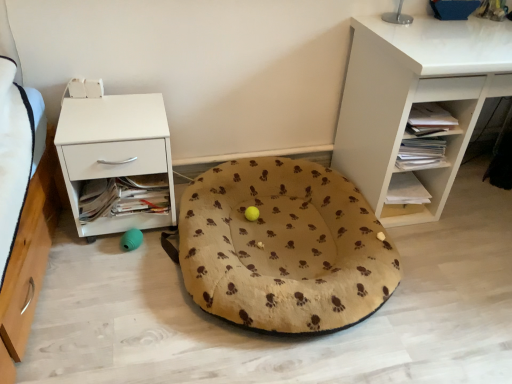
Describe the element at coordinates (283, 247) in the screenshot. I see `beige fabric dog bed at center` at that location.

What do you see at coordinates (114, 152) in the screenshot? The width and height of the screenshot is (512, 384). I see `white matte nightstand at left` at bounding box center [114, 152].

Where is `beige fabric dog bed at center`? The height and width of the screenshot is (384, 512). beige fabric dog bed at center is located at coordinates (283, 247).

Is white matte desk at upper right, arranged as the 1th shelf when viewed from the top, not inside white matte shelf at center right, the 2th shelf viewed from the top?

Yes, white matte desk at upper right, arranged as the 1th shelf when viewed from the top, is outside of white matte shelf at center right, the 2th shelf viewed from the top.

Who is smaller, white matte desk at upper right, the 2th shelf when ordered from bottom to top, or white matte shelf at center right, the 2th shelf viewed from the top?

With smaller size is white matte shelf at center right, the 2th shelf viewed from the top.

From a real-world perspective, is white matte desk at upper right, the 2th shelf when ordered from bottom to top, on top of white matte shelf at center right, marked as the 1th shelf in a bottom-to-top arrangement?

Yes, from a real-world perspective, white matte desk at upper right, the 2th shelf when ordered from bottom to top, is above white matte shelf at center right, marked as the 1th shelf in a bottom-to-top arrangement.

From a real-world perspective, does white matte shelf at center right, the 2th shelf viewed from the top, sit lower than beige fabric dog bed at center?

No, from a real-world perspective, white matte shelf at center right, the 2th shelf viewed from the top, is not beneath beige fabric dog bed at center.

Is white matte shelf at center right, marked as the 1th shelf in a bottom-to-top arrangement, in contact with beige fabric dog bed at center?

No, white matte shelf at center right, marked as the 1th shelf in a bottom-to-top arrangement, is not touching beige fabric dog bed at center.

Can you confirm if white matte shelf at center right, marked as the 1th shelf in a bottom-to-top arrangement, is taller than beige fabric dog bed at center?

In fact, white matte shelf at center right, marked as the 1th shelf in a bottom-to-top arrangement, may be shorter than beige fabric dog bed at center.

Find the location of a particular element. The height and width of the screenshot is (384, 512). table lamp that appears on the left of white matte shelf at center right, marked as the 1th shelf in a bottom-to-top arrangement is located at coordinates (397, 16).

Is metallic silver table lamp at upper center not inside white matte shelf at center right, the 2th shelf viewed from the top?

Absolutely, metallic silver table lamp at upper center is external to white matte shelf at center right, the 2th shelf viewed from the top.

Is metallic silver table lamp at upper center turned away from white matte shelf at center right, the 2th shelf viewed from the top?

No, metallic silver table lamp at upper center's orientation is not away from white matte shelf at center right, the 2th shelf viewed from the top.

From a real-world perspective, is metallic silver table lamp at upper center located higher than white matte shelf at center right, the 2th shelf viewed from the top?

Yes, from a real-world perspective, metallic silver table lamp at upper center is above white matte shelf at center right, the 2th shelf viewed from the top.

Measure the distance from white matte shelf at center right, the 2th shelf viewed from the top, to white matte desk at upper right, the 2th shelf when ordered from bottom to top.

white matte shelf at center right, the 2th shelf viewed from the top, is 9.34 inches from white matte desk at upper right, the 2th shelf when ordered from bottom to top.

Who is smaller, white matte shelf at center right, the 2th shelf viewed from the top, or white matte desk at upper right, arranged as the 1th shelf when viewed from the top?

white matte shelf at center right, the 2th shelf viewed from the top.

Is white matte desk at upper right, the 2th shelf when ordered from bottom to top, surrounded by white matte shelf at center right, the 2th shelf viewed from the top?

No.

Is white matte shelf at center right, marked as the 1th shelf in a bottom-to-top arrangement, next to white matte desk at upper right, the 2th shelf when ordered from bottom to top?

No, white matte shelf at center right, marked as the 1th shelf in a bottom-to-top arrangement, is not next to white matte desk at upper right, the 2th shelf when ordered from bottom to top.

Do you think beige fabric dog bed at center is within white matte desk at upper right, arranged as the 1th shelf when viewed from the top, or outside of it?

beige fabric dog bed at center lies outside white matte desk at upper right, arranged as the 1th shelf when viewed from the top.

Considering the points (246, 313) and (362, 53), which point is behind, point (246, 313) or point (362, 53)?

Positioned behind is point (362, 53).

Considering the sizes of beige fabric dog bed at center and white matte desk at upper right, the 2th shelf when ordered from bottom to top, in the image, is beige fabric dog bed at center taller or shorter than white matte desk at upper right, the 2th shelf when ordered from bottom to top,?

beige fabric dog bed at center is shorter than white matte desk at upper right, the 2th shelf when ordered from bottom to top.

Can you see beige fabric dog bed at center touching white matte desk at upper right, arranged as the 1th shelf when viewed from the top?

No, beige fabric dog bed at center is not beside white matte desk at upper right, arranged as the 1th shelf when viewed from the top.

Is metallic silver table lamp at upper center looking in the opposite direction of white matte desk at upper right, the 2th shelf when ordered from bottom to top?

That's not correct — metallic silver table lamp at upper center is not looking away from white matte desk at upper right, the 2th shelf when ordered from bottom to top.

Consider the image. Considering the positions of objects metallic silver table lamp at upper center and white matte desk at upper right, arranged as the 1th shelf when viewed from the top, in the image provided, who is in front, metallic silver table lamp at upper center or white matte desk at upper right, arranged as the 1th shelf when viewed from the top,?

white matte desk at upper right, arranged as the 1th shelf when viewed from the top.

Can you confirm if metallic silver table lamp at upper center is positioned to the right of white matte desk at upper right, arranged as the 1th shelf when viewed from the top?

No.

Is point (383, 16) behind point (482, 73)?

Yes, it is.

Between metallic silver table lamp at upper center and white matte nightstand at left, which one has smaller width?

With smaller width is metallic silver table lamp at upper center.

Between metallic silver table lamp at upper center and white matte nightstand at left, which one has more height?

white matte nightstand at left.

Who is smaller, metallic silver table lamp at upper center or white matte nightstand at left?

metallic silver table lamp at upper center.

In the scene shown: From a real-world perspective, which object stands above the other?

metallic silver table lamp at upper center is physically above.

Find the location of `shelf below the white matte desk at upper right, arranged as the 1th shelf when viewed from the top (from the image's perspective)`. shelf below the white matte desk at upper right, arranged as the 1th shelf when viewed from the top (from the image's perspective) is located at coordinates (414, 197).

I want to click on shelf that is the 1st one when counting upward from the beige fabric dog bed at center (from the image's perspective), so click(x=414, y=197).

Based on their spatial positions, is white matte shelf at center right, the 2th shelf viewed from the top, or beige fabric dog bed at center further from white matte nightstand at left?

white matte shelf at center right, the 2th shelf viewed from the top.

From the image, which object appears to be farther from beige fabric dog bed at center, white matte desk at upper right, the 2th shelf when ordered from bottom to top, or white matte nightstand at left?

The object further to beige fabric dog bed at center is white matte desk at upper right, the 2th shelf when ordered from bottom to top.

Looking at the image, which one is located closer to beige fabric dog bed at center, white matte shelf at center right, marked as the 1th shelf in a bottom-to-top arrangement, or metallic silver table lamp at upper center?

white matte shelf at center right, marked as the 1th shelf in a bottom-to-top arrangement.

From the image, which object appears to be nearer to white matte shelf at center right, marked as the 1th shelf in a bottom-to-top arrangement, beige fabric dog bed at center or white matte nightstand at left?

beige fabric dog bed at center is positioned closer to the anchor white matte shelf at center right, marked as the 1th shelf in a bottom-to-top arrangement.

When comparing their distances from beige fabric dog bed at center, does metallic silver table lamp at upper center or white matte shelf at center right, marked as the 1th shelf in a bottom-to-top arrangement, seem further?

metallic silver table lamp at upper center is positioned further to the anchor beige fabric dog bed at center.

Estimate the real-world distances between objects in this image. Which object is further from metallic silver table lamp at upper center, white matte desk at upper right, the 2th shelf when ordered from bottom to top, or white matte shelf at center right, marked as the 1th shelf in a bottom-to-top arrangement?

Among the two, white matte shelf at center right, marked as the 1th shelf in a bottom-to-top arrangement, is located further to metallic silver table lamp at upper center.

Estimate the real-world distances between objects in this image. Which object is further from white matte shelf at center right, the 2th shelf viewed from the top, white matte desk at upper right, arranged as the 1th shelf when viewed from the top, or beige fabric dog bed at center?

Among the two, beige fabric dog bed at center is located further to white matte shelf at center right, the 2th shelf viewed from the top.

Which object lies nearer to the anchor point white matte nightstand at left, white matte shelf at center right, marked as the 1th shelf in a bottom-to-top arrangement, or metallic silver table lamp at upper center?

white matte shelf at center right, marked as the 1th shelf in a bottom-to-top arrangement, is closer to white matte nightstand at left.

Find the location of a particular element. dog bed between white matte nightstand at left and white matte shelf at center right, the 2th shelf viewed from the top, in the horizontal direction is located at coordinates (283, 247).

This screenshot has width=512, height=384. Identify the location of shelf situated between beige fabric dog bed at center and white matte desk at upper right, the 2th shelf when ordered from bottom to top, from left to right. (414, 197).

Identify the location of shelf between metallic silver table lamp at upper center and white matte shelf at center right, marked as the 1th shelf in a bottom-to-top arrangement, in the up-down direction. (415, 102).

Find the location of a particular element. table lamp located between white matte nightstand at left and white matte shelf at center right, the 2th shelf viewed from the top, in the left-right direction is located at coordinates (397, 16).